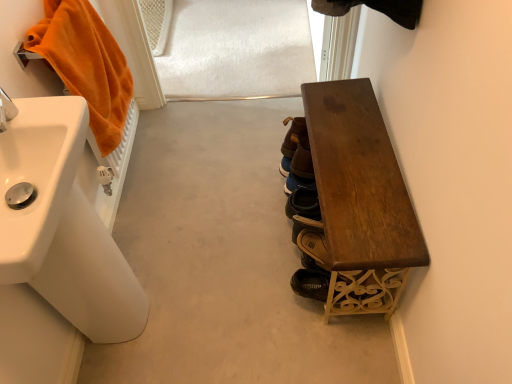
Question: Relative to dark wood bench at right, is orange plush towel at left in front or behind?

Choices:
 (A) front
 (B) behind

Answer: (B)

Question: Does point (79, 72) appear closer or farther from the camera than point (361, 114)?

Choices:
 (A) farther
 (B) closer

Answer: (B)

Question: Which is nearer to the white glossy sink at left, the 1th sink when ordered from front to back?

Choices:
 (A) white glossy sink at left, acting as the 2th sink starting from the front
 (B) dark wood bench at right
 (C) brown leather shoes at center, the 2th footwear in the bottom-to-top sequence
 (D) brown leather shoe at center, which is the first footwear from top to bottom
 (E) orange plush towel at left

Answer: (A)

Question: Considering the real-world distances, which object is closest to the orange plush towel at left?

Choices:
 (A) brown leather shoe at lower center, arranged as the 3th footwear when viewed from the back
 (B) white glossy sink at left, which ranks as the 2th sink in back-to-front order
 (C) dark wood bench at right
 (D) brown leather shoe at center, the 3th footwear ordered from the bottom
 (E) white glossy sink at left, acting as the 2th sink starting from the front

Answer: (B)